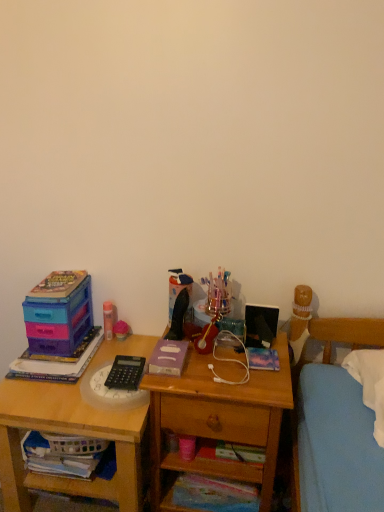
The height and width of the screenshot is (512, 384). In order to click on free spot above wooden desk at left (from a real-world perspective) in this screenshot , I will do `click(69, 378)`.